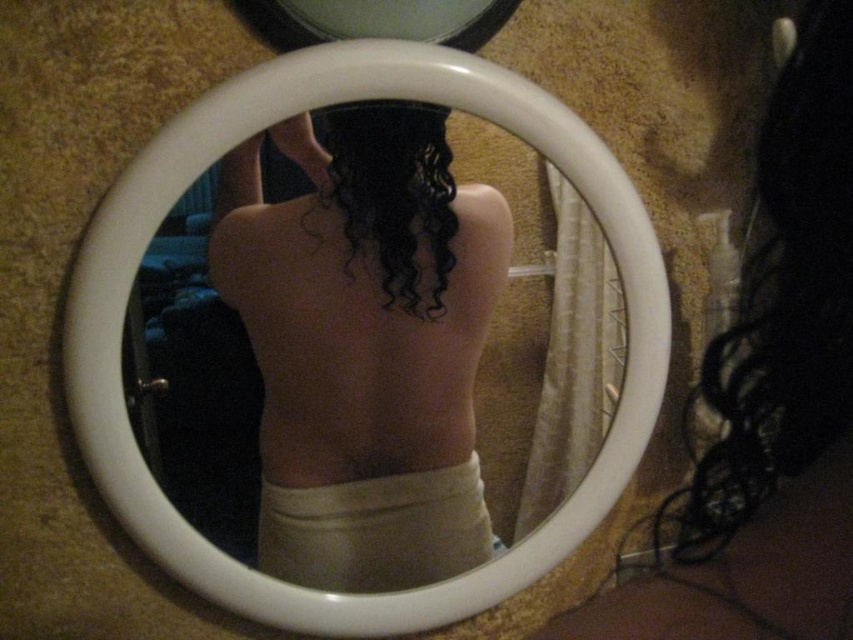
Question: Does smooth beige towel at center have a larger size compared to white plastic mirror at center?

Choices:
 (A) yes
 (B) no

Answer: (B)

Question: Which point is closer to the camera?

Choices:
 (A) (820, 358)
 (B) (431, 172)
 (C) (354, 541)

Answer: (A)

Question: Among these points, which one is nearest to the camera?

Choices:
 (A) (360, 500)
 (B) (421, 230)
 (C) (804, 29)
 (D) (527, 120)

Answer: (C)

Question: Is the position of smooth beige towel at center less distant than that of white plastic mirror at center?

Choices:
 (A) yes
 (B) no

Answer: (B)

Question: Which is nearer to the smooth beige towel at center?

Choices:
 (A) white matte dress at lower center
 (B) curly dark brown hair at center

Answer: (B)

Question: Is black curly hair at upper right wider than curly dark brown hair at center?

Choices:
 (A) no
 (B) yes

Answer: (B)